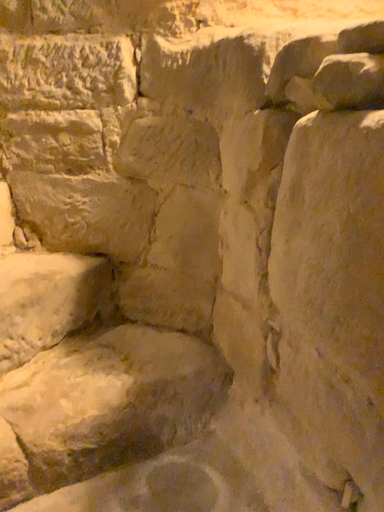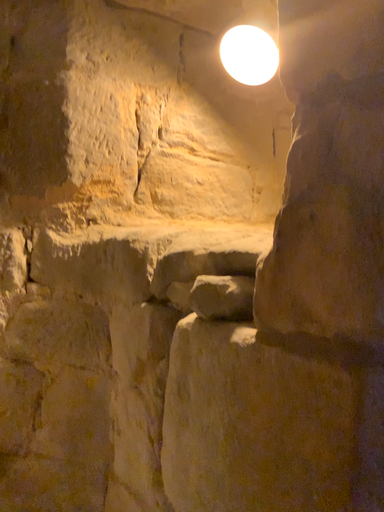
Question: Which way did the camera rotate in the video?

Choices:
 (A) rotated right
 (B) rotated left

Answer: (A)